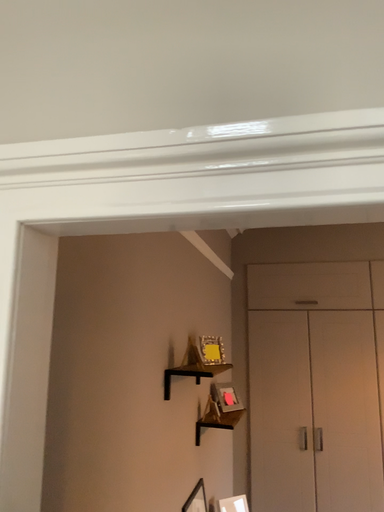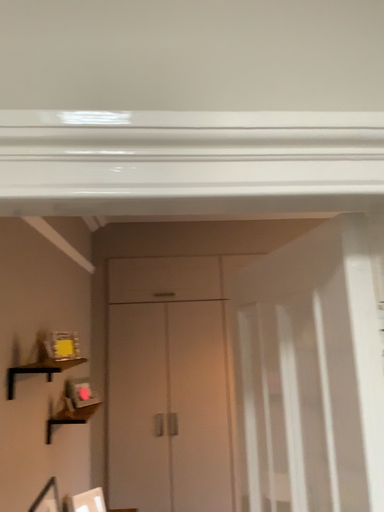
Question: How did the camera likely rotate when shooting the video?

Choices:
 (A) rotated right
 (B) rotated left

Answer: (A)